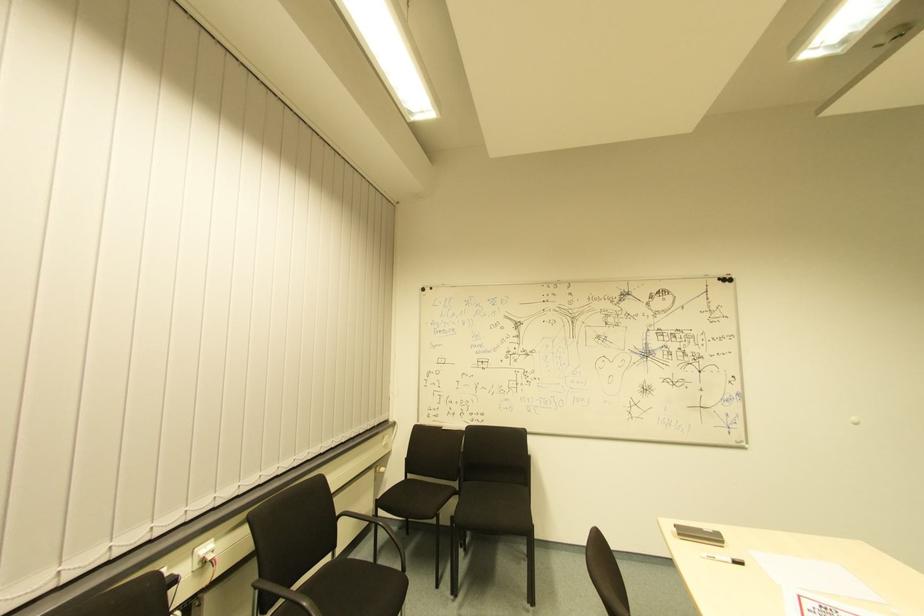
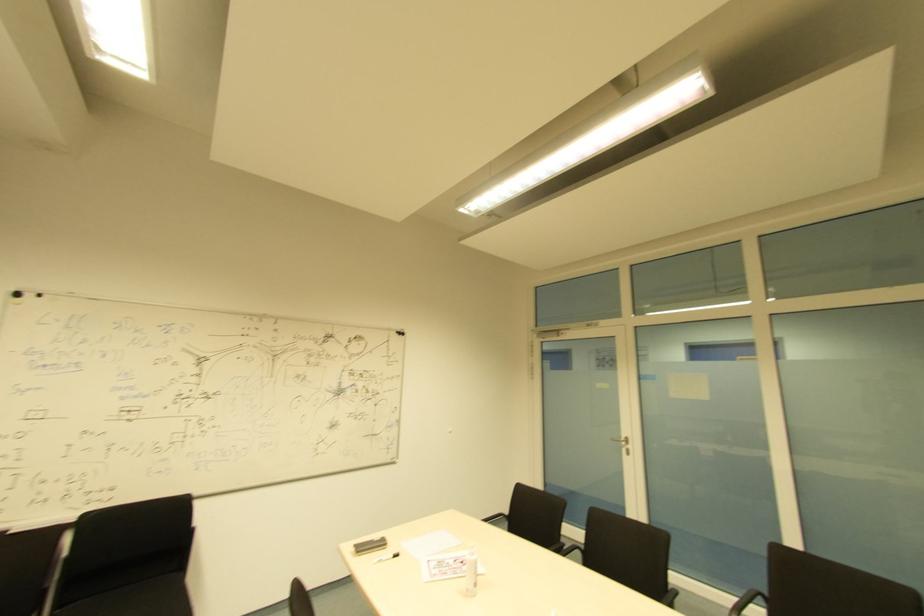
Locate, in the second image, the point that corresponds to pixel 734 560 in the first image.

(394, 554)